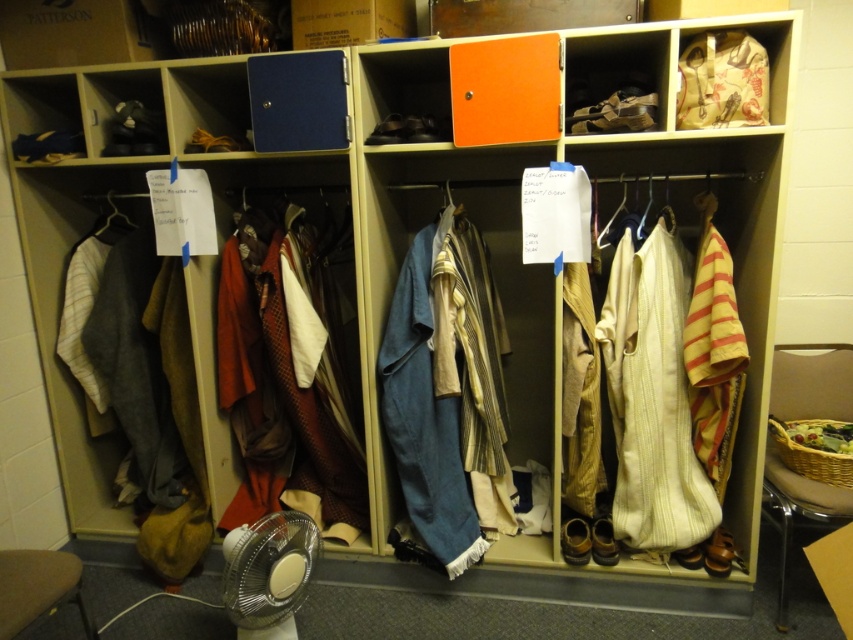
Question: Which object is positioned closest to the white striped fabric at right?

Choices:
 (A) textured wool coat at center
 (B) wooden stool at lower left

Answer: (A)

Question: Can you confirm if textured wool coat at center is positioned to the right of white striped fabric at right?

Choices:
 (A) yes
 (B) no

Answer: (B)

Question: Is the position of blue linen coat at center less distant than that of white plastic fan at lower left?

Choices:
 (A) no
 (B) yes

Answer: (A)

Question: Estimate the real-world distances between objects in this image. Which object is closer to the white striped fabric at right?

Choices:
 (A) textured wool coat at center
 (B) white plastic fan at lower left
 (C) wooden stool at lower left
 (D) blue linen coat at center

Answer: (D)

Question: Which point is closer to the camera?

Choices:
 (A) (318, 552)
 (B) (53, 593)
 (C) (428, 234)

Answer: (B)

Question: Can you confirm if textured wool coat at center is wider than white striped fabric at right?

Choices:
 (A) yes
 (B) no

Answer: (A)